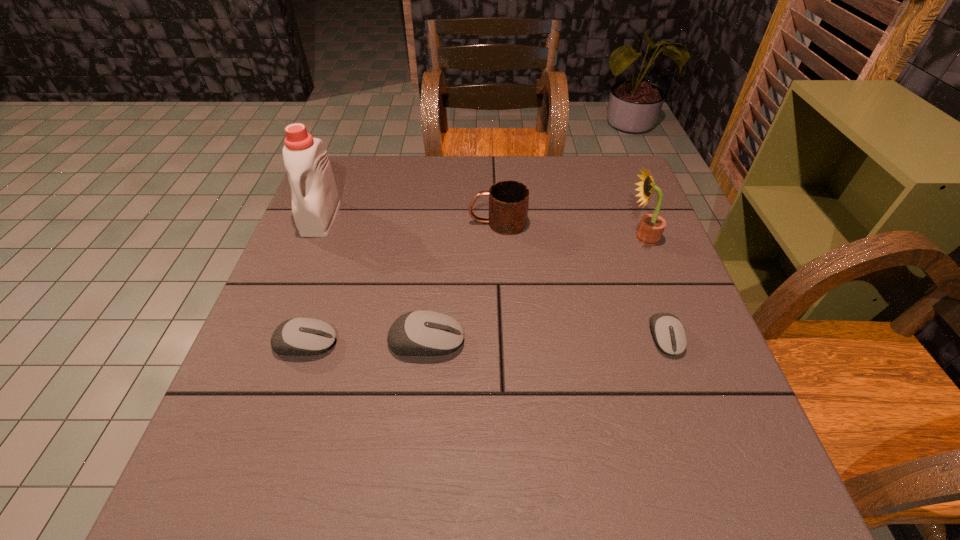
You are a GUI agent. You are given a task and a screenshot of the screen. Output one action in this format:
    pyautogui.click(x=<x>, y=<y>)
    Task: Click on the free space located 0.170m on the wheel side of the second shortest computer equipment
    The width and height of the screenshot is (960, 540).
    Given the screenshot: What is the action you would take?
    pyautogui.click(x=423, y=343)

Find the location of a particular element. free space located 0.390m on the wheel side of the fourth tallest object is located at coordinates pos(660,341).

Where is `free space located 0.070m on the wheel side of the rightmost computer equipment`? This screenshot has height=540, width=960. free space located 0.070m on the wheel side of the rightmost computer equipment is located at coordinates (684, 392).

At what (x,y) coordinates should I click in order to perform the action: click on vacant region located on the side of the third tallest object with the handle. Please return your answer as a coordinate pair (x, y). Looking at the image, I should click on (410, 223).

You are a GUI agent. You are given a task and a screenshot of the screen. Output one action in this format:
    pyautogui.click(x=<x>, y=<y>)
    Task: Click on the free space located on the side of the third tallest object with the handle
    
    Given the screenshot: What is the action you would take?
    pyautogui.click(x=438, y=223)

Where is `vacant position located on the side of the third tallest object with the handle`? vacant position located on the side of the third tallest object with the handle is located at coordinates (348, 223).

Locate an element on the screen. free space located 0.210m on the handle side of the detergent is located at coordinates (287, 303).

You are a GUI agent. You are given a task and a screenshot of the screen. Output one action in this format:
    pyautogui.click(x=<x>, y=<y>)
    Task: Click on the free space located on the face of the second tallest object
    The height and width of the screenshot is (540, 960).
    Given the screenshot: What is the action you would take?
    pyautogui.click(x=585, y=238)

This screenshot has width=960, height=540. Find the location of `vacant space situated 0.340m on the face of the second tallest object`. vacant space situated 0.340m on the face of the second tallest object is located at coordinates (488, 238).

The image size is (960, 540). I want to click on free space located on the face of the second tallest object, so click(x=480, y=238).